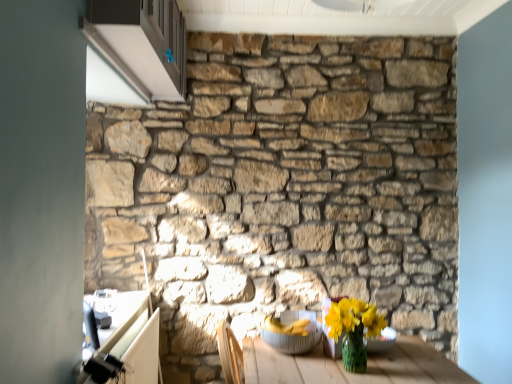
Question: Can you confirm if yellow matte vase at lower right is positioned to the right of natural stone wall at center?

Choices:
 (A) no
 (B) yes

Answer: (B)

Question: Are yellow matte vase at lower right and natural stone wall at center beside each other?

Choices:
 (A) yes
 (B) no

Answer: (B)

Question: Does yellow matte vase at lower right have a lesser height compared to natural stone wall at center?

Choices:
 (A) no
 (B) yes

Answer: (B)

Question: Are yellow matte vase at lower right and natural stone wall at center located far from each other?

Choices:
 (A) yes
 (B) no

Answer: (A)

Question: Considering the relative sizes of yellow matte vase at lower right and natural stone wall at center in the image provided, is yellow matte vase at lower right taller than natural stone wall at center?

Choices:
 (A) no
 (B) yes

Answer: (A)

Question: From a real-world perspective, is yellow matte vase at lower right on natural stone wall at center?

Choices:
 (A) no
 (B) yes

Answer: (A)

Question: Considering the relative positions of white glossy cabinet at upper left and yellow matte vase at lower right in the image provided, is white glossy cabinet at upper left to the right of yellow matte vase at lower right from the viewer's perspective?

Choices:
 (A) no
 (B) yes

Answer: (A)

Question: Is white glossy cabinet at upper left facing away from yellow matte vase at lower right?

Choices:
 (A) yes
 (B) no

Answer: (B)

Question: Is white glossy cabinet at upper left not close to yellow matte vase at lower right?

Choices:
 (A) yes
 (B) no

Answer: (A)

Question: Is white glossy cabinet at upper left in contact with yellow matte vase at lower right?

Choices:
 (A) no
 (B) yes

Answer: (A)

Question: Can you confirm if white glossy cabinet at upper left is shorter than yellow matte vase at lower right?

Choices:
 (A) no
 (B) yes

Answer: (A)

Question: Is white glossy cabinet at upper left aimed at yellow matte vase at lower right?

Choices:
 (A) yes
 (B) no

Answer: (B)

Question: Is translucent glass bowl at lower right, which appears as the 1th glass bowl when viewed from the right, not near white glossy cabinet at upper left?

Choices:
 (A) yes
 (B) no

Answer: (A)